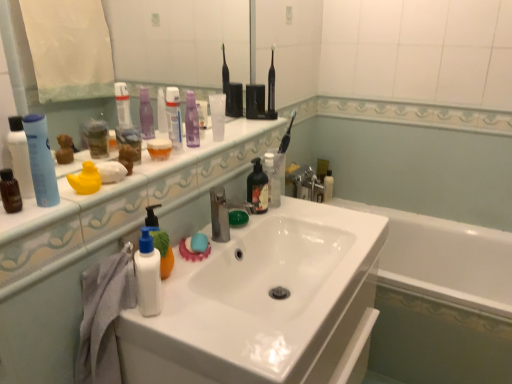
Find the location of a particular element. free location in front of translucent plastic cup at center, arranged as the second mouthwash when viewed from the left is located at coordinates pyautogui.click(x=135, y=177).